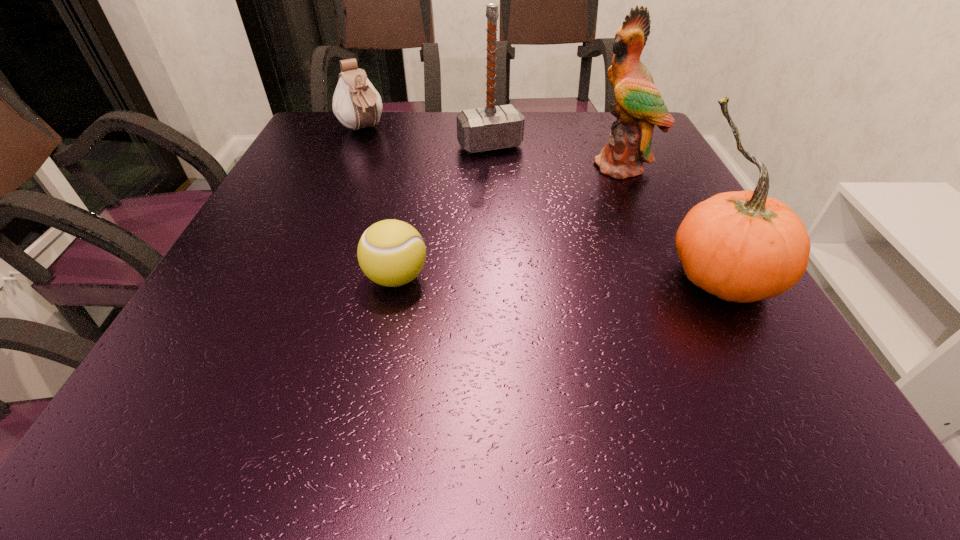
The image size is (960, 540). I want to click on pouch at the far edge, so click(x=356, y=103).

Locate an element on the screen. object that is at the left edge is located at coordinates pos(356,103).

Find the location of `pumpkin that is positioned at the right edge`. pumpkin that is positioned at the right edge is located at coordinates (741, 246).

You are a GUI agent. You are given a task and a screenshot of the screen. Output one action in this format:
    pyautogui.click(x=<x>, y=<y>)
    Task: Click on the parrot located at the right edge
    
    Given the screenshot: What is the action you would take?
    pyautogui.click(x=638, y=107)

You are a GUI agent. You are given a task and a screenshot of the screen. Output one action in this format:
    pyautogui.click(x=<x>, y=<y>)
    Task: Click on the object located at the far left corner
    The width and height of the screenshot is (960, 540).
    Given the screenshot: What is the action you would take?
    pyautogui.click(x=356, y=103)

At what (x,y) coordinates should I click in order to perform the action: click on object that is at the far right corner. Please return your answer as a coordinate pair (x, y). Image resolution: width=960 pixels, height=540 pixels. Looking at the image, I should click on (638, 107).

Image resolution: width=960 pixels, height=540 pixels. Identify the location of free space at the far edge. (456, 144).

Identify the location of vacant space at the left edge of the desktop. (269, 220).

The image size is (960, 540). In the image, there is a desktop. Identify the location of vacant space at the right edge. (634, 200).

Locate an element on the screen. vacant space at the far left corner of the desktop is located at coordinates (351, 136).